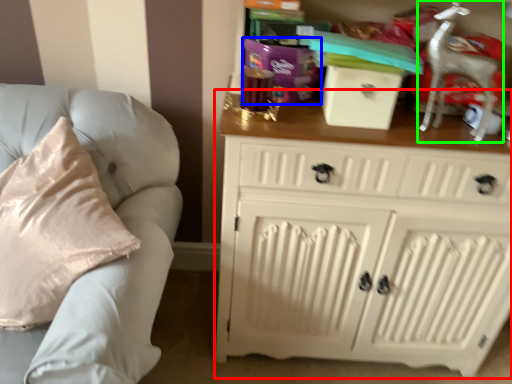
Question: Which object is the farthest from chest of drawers (highlighted by a red box)? Choose among these: gift (highlighted by a blue box) or rocking chair (highlighted by a green box).

Choices:
 (A) gift
 (B) rocking chair

Answer: (A)